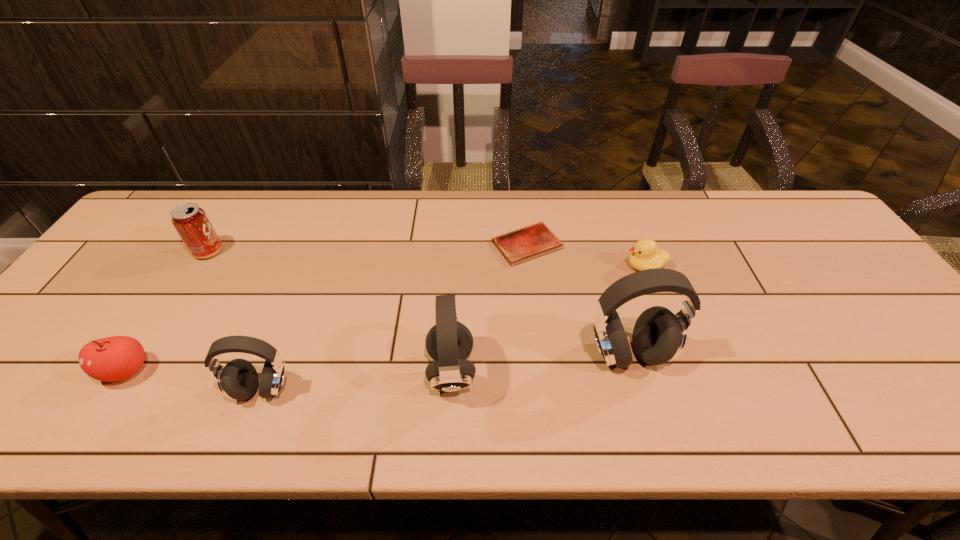
Identify the location of vacant spot to place a headset on the right. The image size is (960, 540). (796, 338).